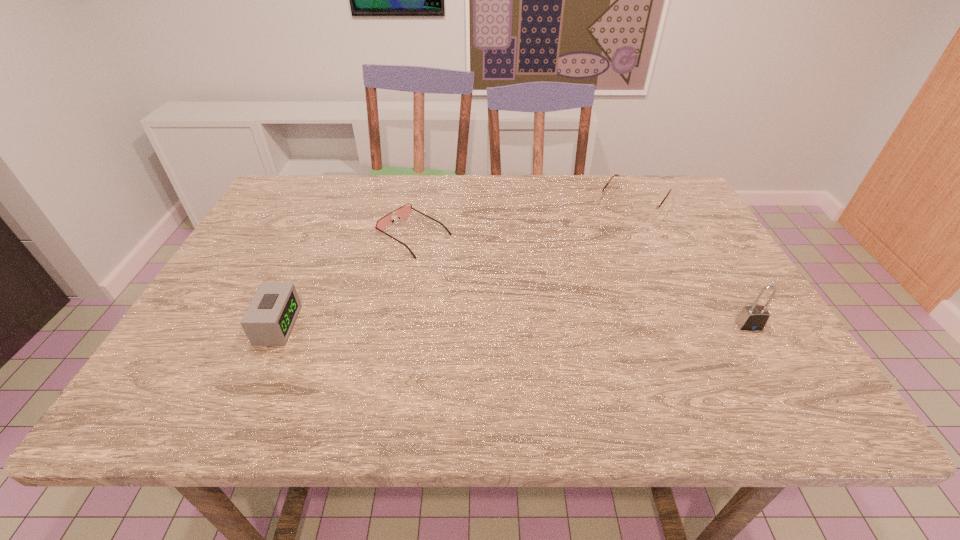
In order to click on vacant space on the desktop that is between the leftmost object and the tallest object and is positioned on the front-facing side of the spectacles in this screenshot , I will do pyautogui.click(x=550, y=325).

Where is `vacant space on the desktop that is between the leftmost object and the padlock and is positioned on the bridge of the sunglasses`? vacant space on the desktop that is between the leftmost object and the padlock and is positioned on the bridge of the sunglasses is located at coordinates (573, 325).